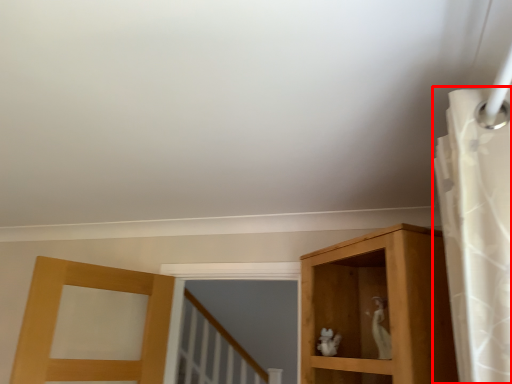
Question: From the image's perspective, where is shower curtain (annotated by the red box) located relative to animal?

Choices:
 (A) below
 (B) above

Answer: (B)